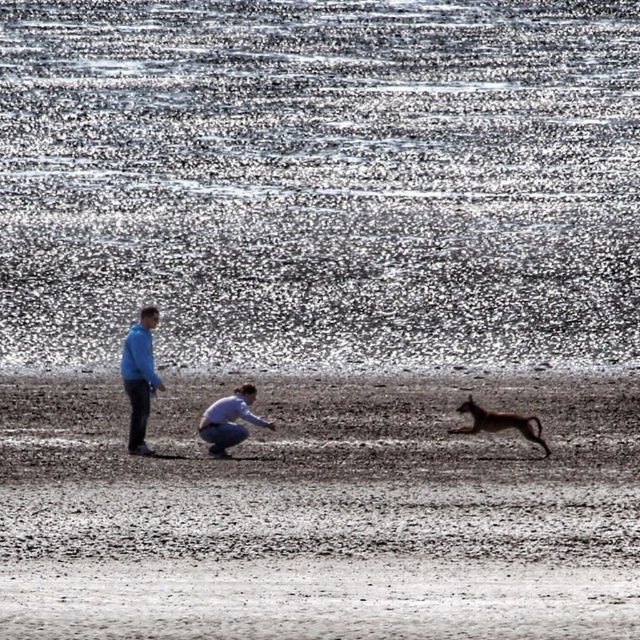
Can you confirm if brown sandy beach at center is wider than blue fabric man at left?

Yes.

Is point (182, 518) closer to camera compared to point (132, 368)?

That is True.

You are a GUI agent. You are given a task and a screenshot of the screen. Output one action in this format:
    pyautogui.click(x=<x>, y=<y>)
    Task: Click on the brown sandy beach at center
    
    Given the screenshot: What is the action you would take?
    pyautogui.click(x=321, y=513)

Does blue fabric man at left have a greater height compared to light blue fabric squat at center?

Yes.

Between point (125, 362) and point (224, 428), which one is positioned in front?

Point (224, 428) is more forward.

Locate an element on the screen. blue fabric man at left is located at coordinates (140, 376).

Is the position of blue fabric man at left more distant than that of brown furry dog at right?

That is True.

This screenshot has width=640, height=640. I want to click on blue fabric man at left, so click(x=140, y=376).

This screenshot has height=640, width=640. Identify the location of blue fabric man at left. (140, 376).